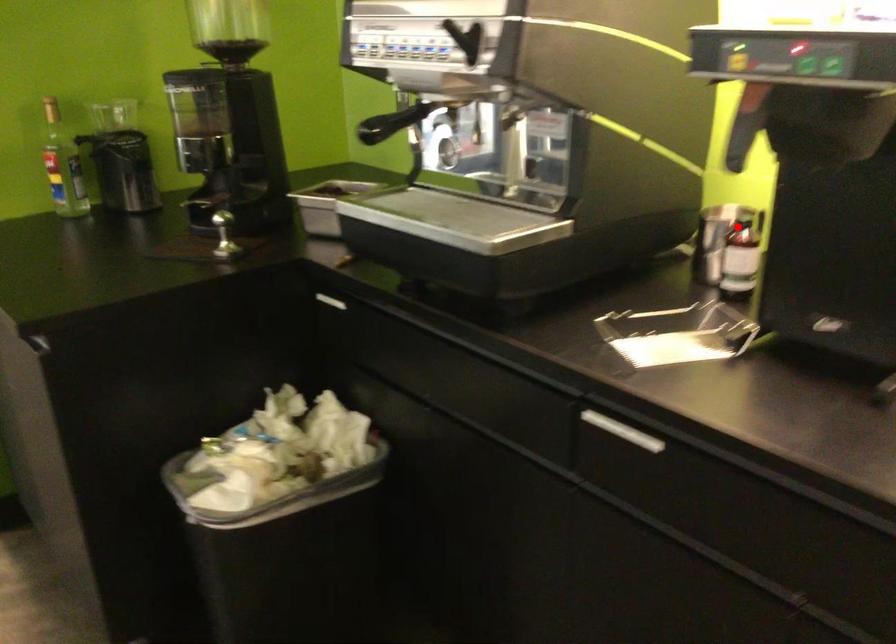
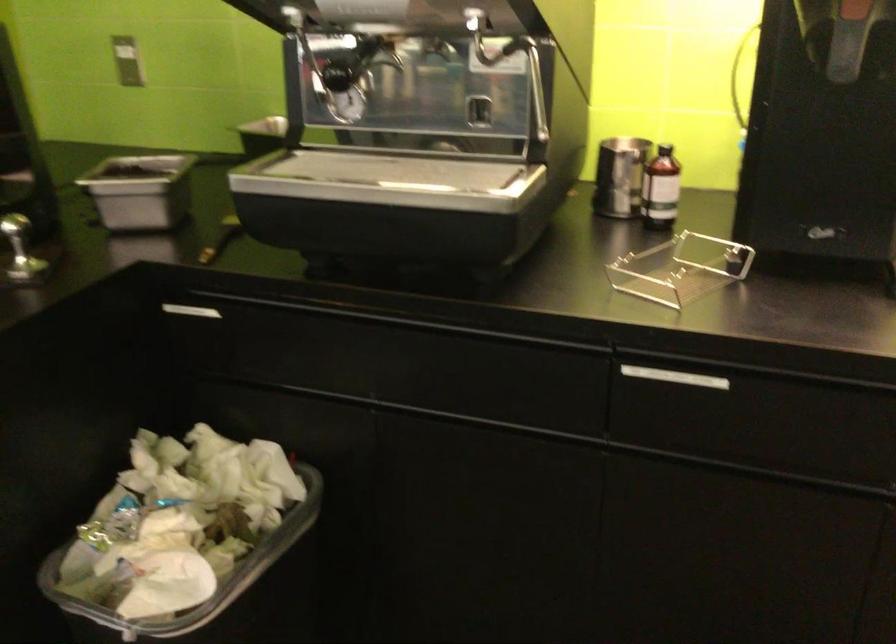
Where in the second image is the point corresponding to the highlighted location from the first image?

(666, 152)